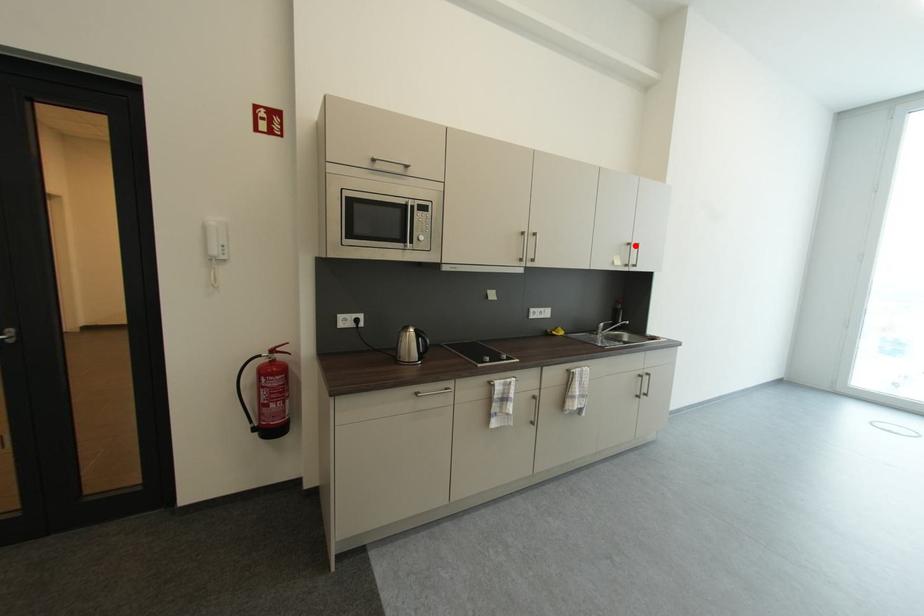
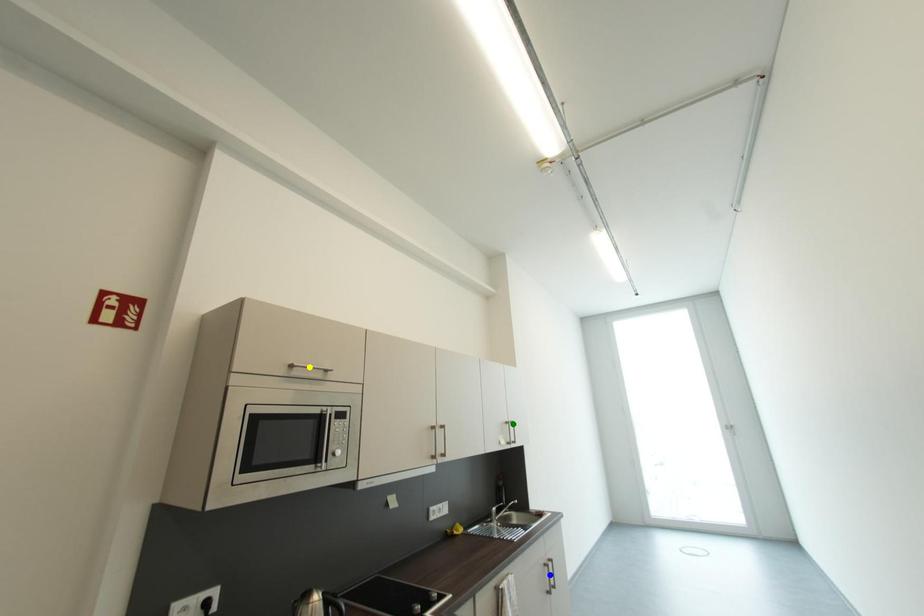
Question: I am providing you with two images of the same scene from different viewpoints. A red point is marked on the first image. You are given multiple points on the second image. Which point in image 2 represents the same 3d spot as the red point in image 1?

Choices:
 (A) yellow point
 (B) green point
 (C) blue point

Answer: (B)